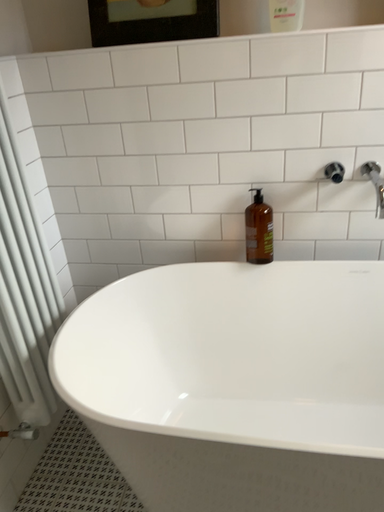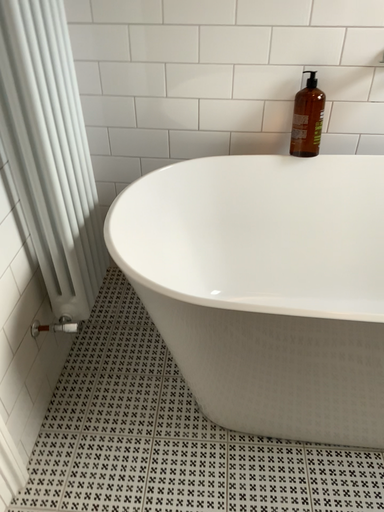
Question: How did the camera likely rotate when shooting the video?

Choices:
 (A) rotated upward
 (B) rotated downward

Answer: (B)